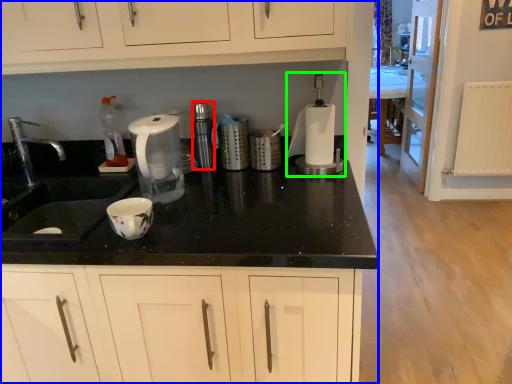
Question: Which object is the closest to the appliance (highlighted by a red box)? Choose among these: dresser (highlighted by a blue box) or blender (highlighted by a green box).

Choices:
 (A) dresser
 (B) blender

Answer: (B)